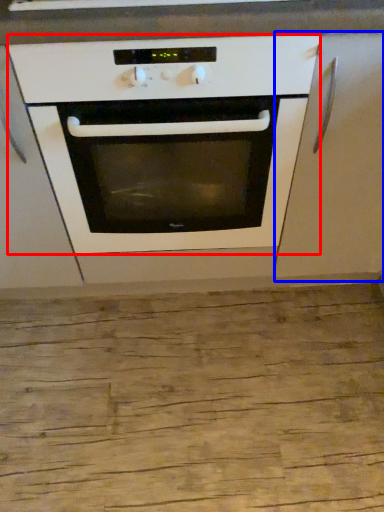
Question: Among these objects, which one is nearest to the camera, oven (highlighted by a red box) or cabinetry (highlighted by a blue box)?

Choices:
 (A) oven
 (B) cabinetry

Answer: (A)